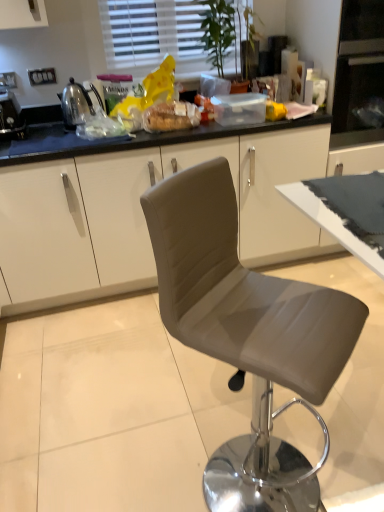
Question: Considering the positions of white blinds at upper center and shiny metallic kettle at left, which is counted as the second appliance, starting from the left, in the image, is white blinds at upper center wider or thinner than shiny metallic kettle at left, which is counted as the second appliance, starting from the left,?

Choices:
 (A) thin
 (B) wide

Answer: (A)

Question: In terms of height, does white blinds at upper center look taller or shorter compared to shiny metallic kettle at left, which is counted as the second appliance, starting from the left?

Choices:
 (A) tall
 (B) short

Answer: (A)

Question: Considering the real-world distances, which object is farthest from the satin grey chair at center?

Choices:
 (A) translucent plastic bread at center
 (B) metallic silver toaster at left, the 2th appliance positioned from the right
 (C) white blinds at upper center
 (D) shiny metallic kettle at left, which is counted as the second appliance, starting from the left

Answer: (C)

Question: Considering the real-world distances, which object is closest to the shiny metallic kettle at left, which is counted as the second appliance, starting from the left?

Choices:
 (A) metallic silver toaster at left, the 2th appliance positioned from the right
 (B) white blinds at upper center
 (C) satin grey chair at center
 (D) translucent plastic bread at center

Answer: (A)